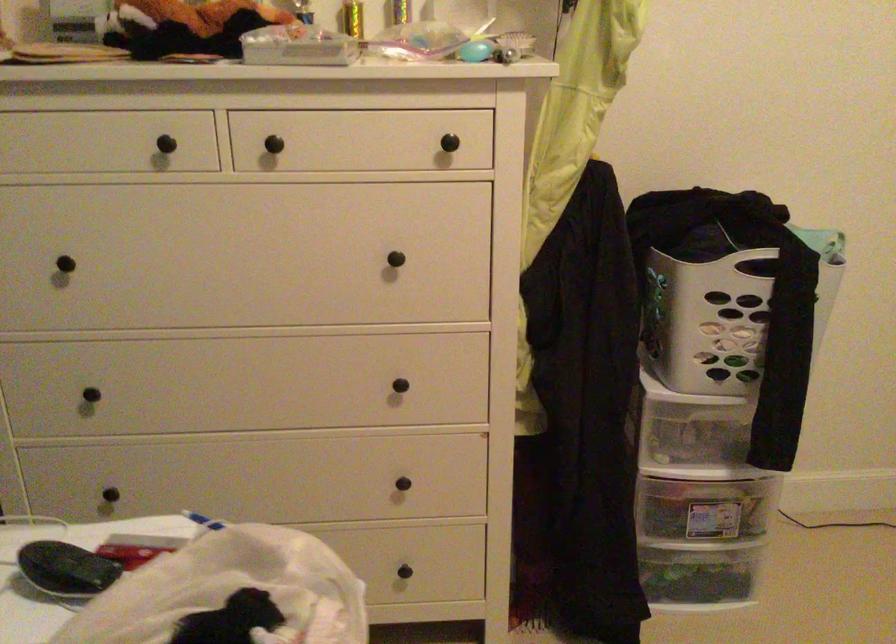
Find where to lift the blue oval object. Please return your answer as a coordinate pair (x, y).

(475, 51)